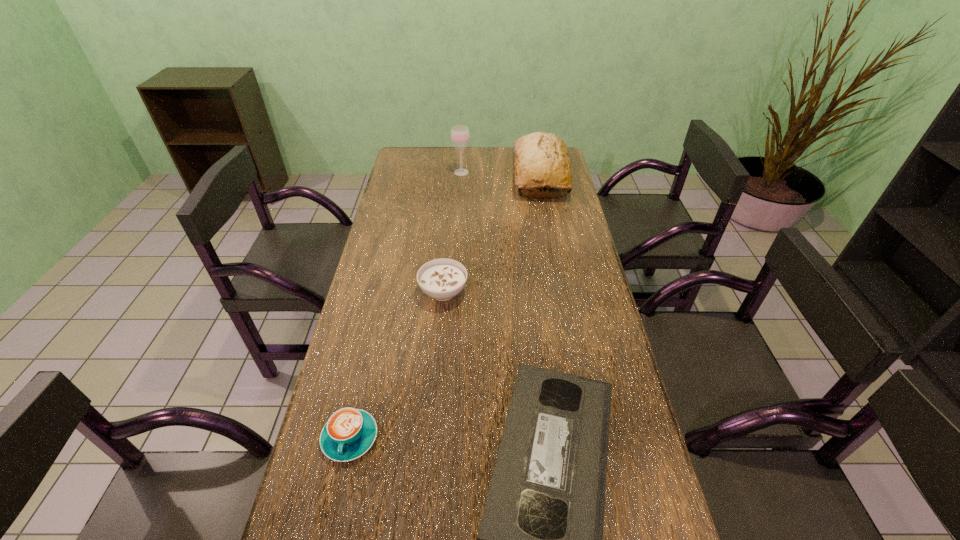
Locate which object ranks third in proximity to the cappuccino. Please provide its 2D coordinates. Your answer should be formatted as a tuple, i.e. [(x, y)], where the tuple contains the x and y coordinates of a point satisfying the conditions above.

[(541, 159)]